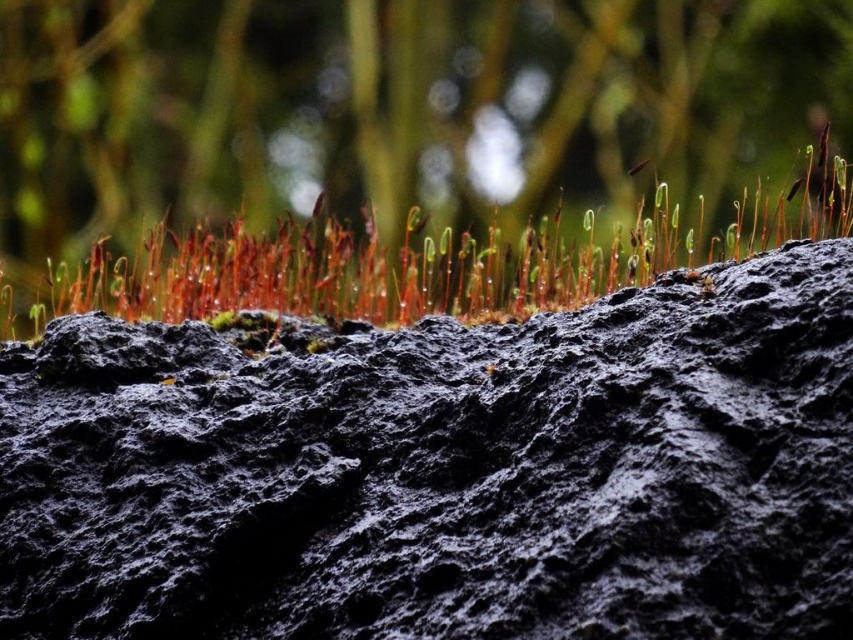
Is black rough rock at upper center taller than green matte grass at upper center?

Yes, black rough rock at upper center is taller than green matte grass at upper center.

Based on the photo, does black rough rock at upper center come behind green matte grass at upper center?

No, black rough rock at upper center is in front of green matte grass at upper center.

Is point (519, 420) farther from camera compared to point (286, 243)?

No, (519, 420) is in front of (286, 243).

Identify the location of black rough rock at upper center. Image resolution: width=853 pixels, height=640 pixels. click(444, 470).